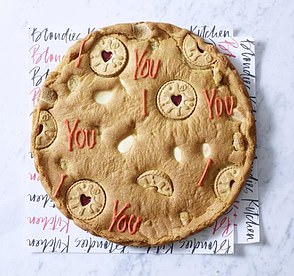
In order to click on table in this screenshot , I will do `click(266, 119)`.